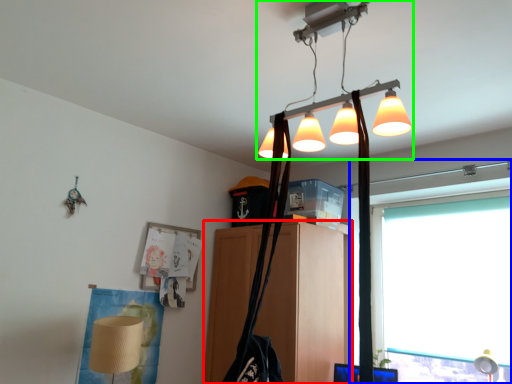
Question: Considering the real-world distances, which object is farthest from furniture (highlighted by a red box)? window (highlighted by a blue box) or lamp (highlighted by a green box)?

Choices:
 (A) window
 (B) lamp

Answer: (B)